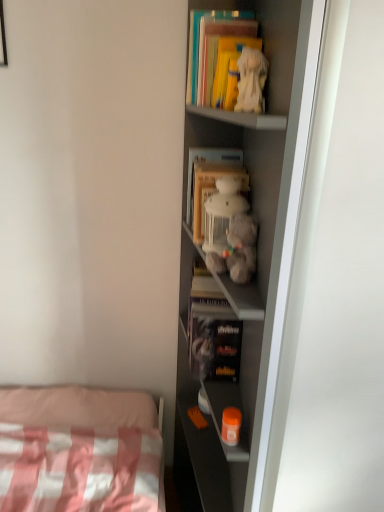
Where is `wooden bookshelf at center, which is the second book in bottom-to-top order`? wooden bookshelf at center, which is the second book in bottom-to-top order is located at coordinates (209, 181).

Measure the distance between white plush toy at upper center, the first toy positioned from the top, and camera.

A distance of 34.61 inches exists between white plush toy at upper center, the first toy positioned from the top, and camera.

The image size is (384, 512). What do you see at coordinates (215, 50) in the screenshot?
I see `matte yellow book at upper center, arranged as the first book when viewed from the top` at bounding box center [215, 50].

Image resolution: width=384 pixels, height=512 pixels. Describe the element at coordinates (228, 67) in the screenshot. I see `yellow matte book at upper center, which is the second book from top to bottom` at that location.

Image resolution: width=384 pixels, height=512 pixels. Identify the location of wooden bookshelf at center, which is the second book in bottom-to-top order. (209, 181).

Considering the relative sizes of fluffy gray stuffed animal at center, which is counted as the third toy, starting from the top, and fluffy white teddy bear at center, which is the third toy in bottom-to-top order, in the image provided, is fluffy gray stuffed animal at center, which is counted as the third toy, starting from the top, thinner than fluffy white teddy bear at center, which is the third toy in bottom-to-top order,?

Correct, the width of fluffy gray stuffed animal at center, which is counted as the third toy, starting from the top, is less than that of fluffy white teddy bear at center, which is the third toy in bottom-to-top order.

Can we say fluffy gray stuffed animal at center, which is counted as the third toy, starting from the top, lies outside fluffy white teddy bear at center, which appears as the 2th toy when viewed from the top?

Yes, fluffy gray stuffed animal at center, which is counted as the third toy, starting from the top, is outside of fluffy white teddy bear at center, which appears as the 2th toy when viewed from the top.

Is point (243, 250) farther from camera compared to point (221, 206)?

No, it is not.

Which is more to the left, fluffy gray stuffed animal at center, arranged as the 2th toy when ordered from the bottom, or fluffy white teddy bear at center, which appears as the 2th toy when viewed from the top?

From the viewer's perspective, fluffy white teddy bear at center, which appears as the 2th toy when viewed from the top, appears more on the left side.

Based on their positions, is hardcover book at center, the first book when ordered from bottom to top, located to the left or right of fluffy gray stuffed animal at center, which is counted as the third toy, starting from the top?

hardcover book at center, the first book when ordered from bottom to top, is to the left of fluffy gray stuffed animal at center, which is counted as the third toy, starting from the top.

Considering the relative positions of hardcover book at center, arranged as the 4th book when viewed from the top, and fluffy gray stuffed animal at center, arranged as the 2th toy when ordered from the bottom, in the image provided, is hardcover book at center, arranged as the 4th book when viewed from the top, behind fluffy gray stuffed animal at center, arranged as the 2th toy when ordered from the bottom,?

Yes, hardcover book at center, arranged as the 4th book when viewed from the top, is further from the camera.

In the image, is matte yellow book at upper center, arranged as the first book when viewed from the top, positioned in front of or behind white plush toy at upper center, the 4th toy ordered from the bottom?

matte yellow book at upper center, arranged as the first book when viewed from the top, is behind white plush toy at upper center, the 4th toy ordered from the bottom.

Are matte yellow book at upper center, which appears as the fourth book when ordered from the bottom, and white plush toy at upper center, the 4th toy ordered from the bottom, located far from each other?

matte yellow book at upper center, which appears as the fourth book when ordered from the bottom, is near white plush toy at upper center, the 4th toy ordered from the bottom, not far away.

Between matte yellow book at upper center, which appears as the fourth book when ordered from the bottom, and white plush toy at upper center, the first toy positioned from the top, which one appears on the right side from the viewer's perspective?

Positioned to the right is white plush toy at upper center, the first toy positioned from the top.

What are the coordinates of `the 2nd book to the left when counting from the white plush toy at upper center, the 4th toy ordered from the bottom` in the screenshot? It's located at (215, 50).

Would you say fluffy gray stuffed animal at center, which is counted as the third toy, starting from the top, is to the left or to the right of matte yellow book at upper center, which appears as the fourth book when ordered from the bottom, in the picture?

A: From the image, it's evident that fluffy gray stuffed animal at center, which is counted as the third toy, starting from the top, is to the left of matte yellow book at upper center, which appears as the fourth book when ordered from the bottom.

Would you say matte yellow book at upper center, arranged as the first book when viewed from the top, is part of fluffy gray stuffed animal at center, arranged as the 2th toy when ordered from the bottom,'s contents?

No.

Based on the photo, considering the sizes of objects fluffy gray stuffed animal at center, which is counted as the third toy, starting from the top, and matte yellow book at upper center, which appears as the fourth book when ordered from the bottom, in the image provided, who is taller, fluffy gray stuffed animal at center, which is counted as the third toy, starting from the top, or matte yellow book at upper center, which appears as the fourth book when ordered from the bottom,?

matte yellow book at upper center, which appears as the fourth book when ordered from the bottom.

Could you tell me if orange plastic container at lower center, which is the first toy in bottom-to-top order, is facing white plush toy at upper center, the 4th toy ordered from the bottom?

No, orange plastic container at lower center, which is the first toy in bottom-to-top order, is not turned towards white plush toy at upper center, the 4th toy ordered from the bottom.

From a real-world perspective, is orange plastic container at lower center, the fourth toy when ordered from top to bottom, located beneath white plush toy at upper center, the first toy positioned from the top?

Indeed, from a real-world perspective, orange plastic container at lower center, the fourth toy when ordered from top to bottom, is positioned beneath white plush toy at upper center, the first toy positioned from the top.

Considering the sizes of objects orange plastic container at lower center, the fourth toy when ordered from top to bottom, and white plush toy at upper center, the first toy positioned from the top, in the image provided, who is shorter, orange plastic container at lower center, the fourth toy when ordered from top to bottom, or white plush toy at upper center, the first toy positioned from the top,?

orange plastic container at lower center, the fourth toy when ordered from top to bottom, is shorter.

From a real-world perspective, is fluffy gray stuffed animal at center, which is counted as the third toy, starting from the top, located beneath matte gray shelf at center?

Incorrect, from a real-world perspective, fluffy gray stuffed animal at center, which is counted as the third toy, starting from the top, is higher than matte gray shelf at center.

Consider the image. Is fluffy gray stuffed animal at center, arranged as the 2th toy when ordered from the bottom, facing towards matte gray shelf at center?

Yes, fluffy gray stuffed animal at center, arranged as the 2th toy when ordered from the bottom, faces towards matte gray shelf at center.

Would you consider fluffy gray stuffed animal at center, which is counted as the third toy, starting from the top, to be distant from matte gray shelf at center?

They are positioned close to each other.

Is point (229, 263) positioned after point (220, 506)?

No, (229, 263) is in front of (220, 506).

Is point (229, 207) closer or farther from the camera than point (233, 167)?

Point (229, 207) is closer to the camera than point (233, 167).

From the image's perspective, which is above, fluffy white teddy bear at center, which appears as the 2th toy when viewed from the top, or wooden bookshelf at center, the third book in the top-to-bottom sequence?

wooden bookshelf at center, the third book in the top-to-bottom sequence, from the image's perspective.

Is fluffy white teddy bear at center, which is the third toy in bottom-to-top order, to the left or to the right of wooden bookshelf at center, which is the second book in bottom-to-top order, in the image?

fluffy white teddy bear at center, which is the third toy in bottom-to-top order, is to the right of wooden bookshelf at center, which is the second book in bottom-to-top order.

Based on the photo, between fluffy white teddy bear at center, which is the third toy in bottom-to-top order, and wooden bookshelf at center, which is the second book in bottom-to-top order, which one has larger size?

wooden bookshelf at center, which is the second book in bottom-to-top order.

From the image's perspective, starting from the fluffy gray stuffed animal at center, arranged as the 2th toy when ordered from the bottom, which toy is the 1st one above? Please provide its 2D coordinates.

[(222, 213)]

Where is `the 3rd toy in front of the hardcover book at center, arranged as the 4th book when viewed from the top, counting from the anchor's position`? This screenshot has height=512, width=384. the 3rd toy in front of the hardcover book at center, arranged as the 4th book when viewed from the top, counting from the anchor's position is located at coordinates (238, 249).

When comparing their distances from wooden bookshelf at center, which is the second book in bottom-to-top order, does yellow matte book at upper center, which is the 3th book in bottom-to-top order, or fluffy gray stuffed animal at center, which is counted as the third toy, starting from the top, seem further?

Among the two, yellow matte book at upper center, which is the 3th book in bottom-to-top order, is located further to wooden bookshelf at center, which is the second book in bottom-to-top order.

Looking at the image, which one is located further to white plush toy at upper center, the 4th toy ordered from the bottom, wooden bookshelf at center, the third book in the top-to-bottom sequence, or orange plastic container at lower center, the fourth toy when ordered from top to bottom?

The object further to white plush toy at upper center, the 4th toy ordered from the bottom, is orange plastic container at lower center, the fourth toy when ordered from top to bottom.

Which object lies nearer to the anchor point fluffy white teddy bear at center, which appears as the 2th toy when viewed from the top, white plush toy at upper center, the first toy positioned from the top, or matte gray shelf at center?

white plush toy at upper center, the first toy positioned from the top, lies closer to fluffy white teddy bear at center, which appears as the 2th toy when viewed from the top, than the other object.

When comparing their distances from orange plastic container at lower center, the fourth toy when ordered from top to bottom, does matte yellow book at upper center, which appears as the fourth book when ordered from the bottom, or fluffy gray stuffed animal at center, which is counted as the third toy, starting from the top, seem closer?

Based on the image, fluffy gray stuffed animal at center, which is counted as the third toy, starting from the top, appears to be nearer to orange plastic container at lower center, the fourth toy when ordered from top to bottom.

Considering their positions, is hardcover book at center, the first book when ordered from bottom to top, positioned further to matte yellow book at upper center, which appears as the fourth book when ordered from the bottom, than fluffy gray stuffed animal at center, which is counted as the third toy, starting from the top?

Among the two, hardcover book at center, the first book when ordered from bottom to top, is located further to matte yellow book at upper center, which appears as the fourth book when ordered from the bottom.

Which object lies further to the anchor point matte yellow book at upper center, which appears as the fourth book when ordered from the bottom, orange plastic container at lower center, the fourth toy when ordered from top to bottom, or fluffy white teddy bear at center, which appears as the 2th toy when viewed from the top?

orange plastic container at lower center, the fourth toy when ordered from top to bottom, is positioned further to the anchor matte yellow book at upper center, which appears as the fourth book when ordered from the bottom.

Considering their positions, is matte yellow book at upper center, arranged as the first book when viewed from the top, positioned further to hardcover book at center, arranged as the 4th book when viewed from the top, than white plush toy at upper center, the 4th toy ordered from the bottom?

matte yellow book at upper center, arranged as the first book when viewed from the top, lies further to hardcover book at center, arranged as the 4th book when viewed from the top, than the other object.

Which object lies further to the anchor point yellow matte book at upper center, which is the second book from top to bottom, fluffy white teddy bear at center, which appears as the 2th toy when viewed from the top, or hardcover book at center, arranged as the 4th book when viewed from the top?

hardcover book at center, arranged as the 4th book when viewed from the top, is positioned further to the anchor yellow matte book at upper center, which is the second book from top to bottom.

Where is `book between white plush toy at upper center, the 4th toy ordered from the bottom, and fluffy gray stuffed animal at center, which is counted as the third toy, starting from the top, in the up-down direction`? book between white plush toy at upper center, the 4th toy ordered from the bottom, and fluffy gray stuffed animal at center, which is counted as the third toy, starting from the top, in the up-down direction is located at coordinates (209, 181).

Where is `book between white plush toy at upper center, the 4th toy ordered from the bottom, and matte gray shelf at center vertically`? The height and width of the screenshot is (512, 384). book between white plush toy at upper center, the 4th toy ordered from the bottom, and matte gray shelf at center vertically is located at coordinates (209, 181).

You are a GUI agent. You are given a task and a screenshot of the screen. Output one action in this format:
    pyautogui.click(x=<x>, y=<y>)
    Task: Click on the shelf that lies between white plush toy at upper center, the first toy positioned from the top, and hardcover book at center, the first book when ordered from bottom to top, from top to bottom
    This screenshot has width=384, height=512.
    Given the screenshot: What is the action you would take?
    pyautogui.click(x=257, y=258)

Image resolution: width=384 pixels, height=512 pixels. I want to click on book between matte yellow book at upper center, arranged as the first book when viewed from the top, and wooden bookshelf at center, the third book in the top-to-bottom sequence, in the up-down direction, so click(x=228, y=67).